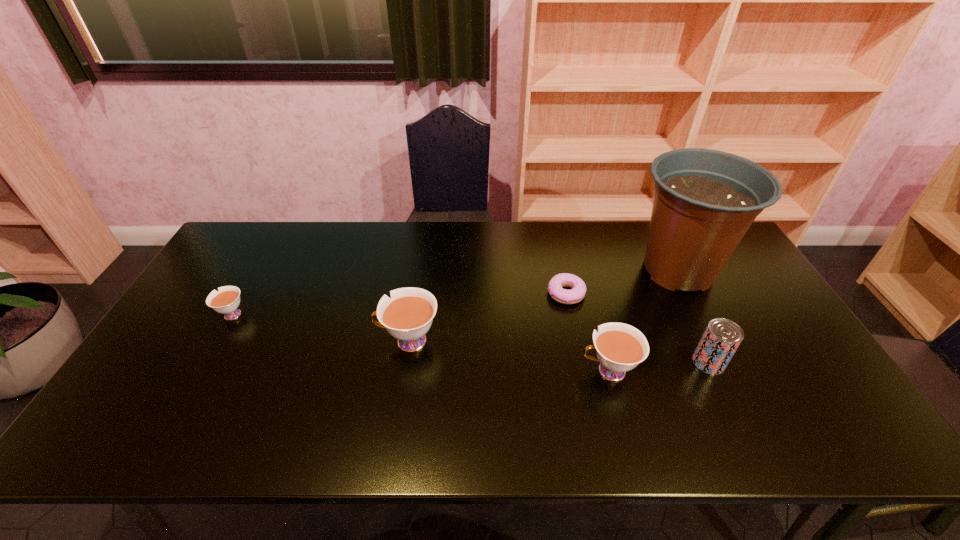
Find the location of a particular element. object that is at the far right corner is located at coordinates pos(705,200).

In the image, there is a desktop. What are the coordinates of `vacant space at the far edge` in the screenshot? It's located at (623, 238).

What are the coordinates of `free region at the near edge` in the screenshot? It's located at (289, 384).

Identify the location of vacant space at the left edge of the desktop. (196, 311).

In order to click on empty location between the shortest object and the beer can in this screenshot , I will do `click(637, 328)`.

The height and width of the screenshot is (540, 960). Find the location of `vacant space that is in between the tallest object and the beer can`. vacant space that is in between the tallest object and the beer can is located at coordinates (693, 316).

Locate an element on the screen. This screenshot has width=960, height=540. vacant region between the shortest teacup and the beer can is located at coordinates (469, 339).

Locate an element on the screen. blank region between the beer can and the second shortest teacup is located at coordinates (659, 367).

Where is `blank region between the beer can and the shortest object`? This screenshot has height=540, width=960. blank region between the beer can and the shortest object is located at coordinates (637, 328).

At what (x,y) coordinates should I click in order to perform the action: click on vacant area that lies between the second shortest teacup and the fifth object from right to left. Please return your answer as a coordinate pair (x, y). This screenshot has height=540, width=960. Looking at the image, I should click on (508, 356).